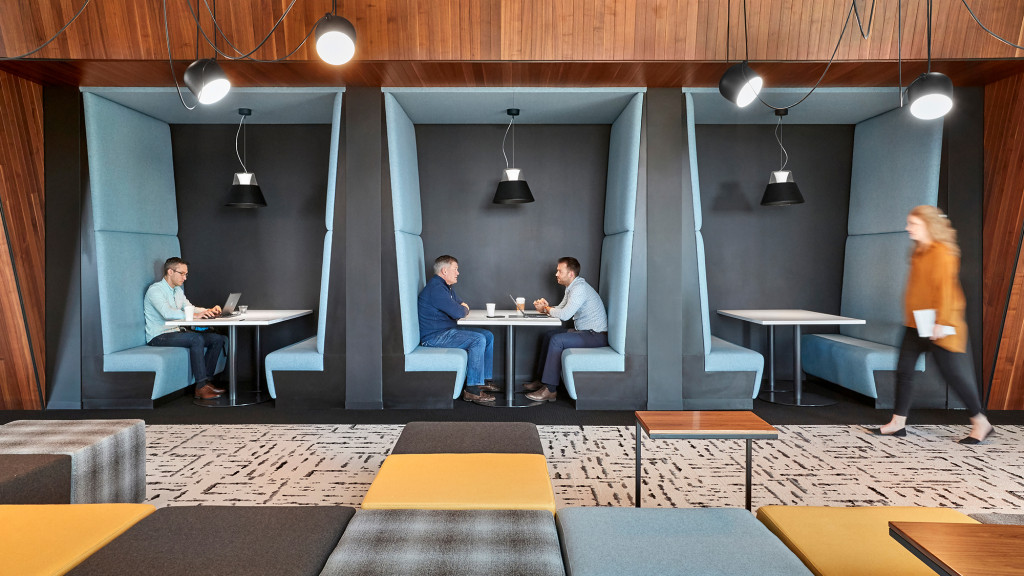
Find the location of a particular element. carpet is located at coordinates (608, 483).